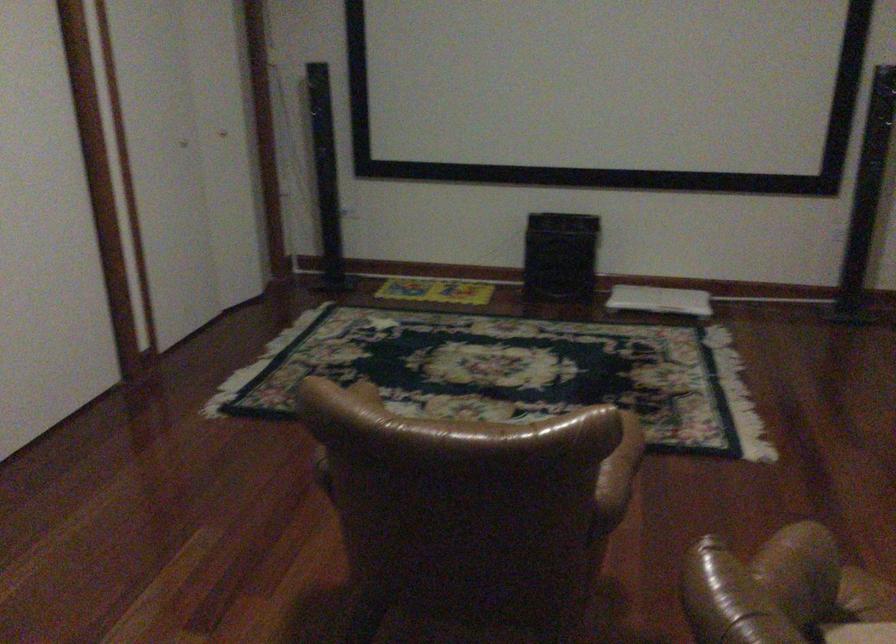
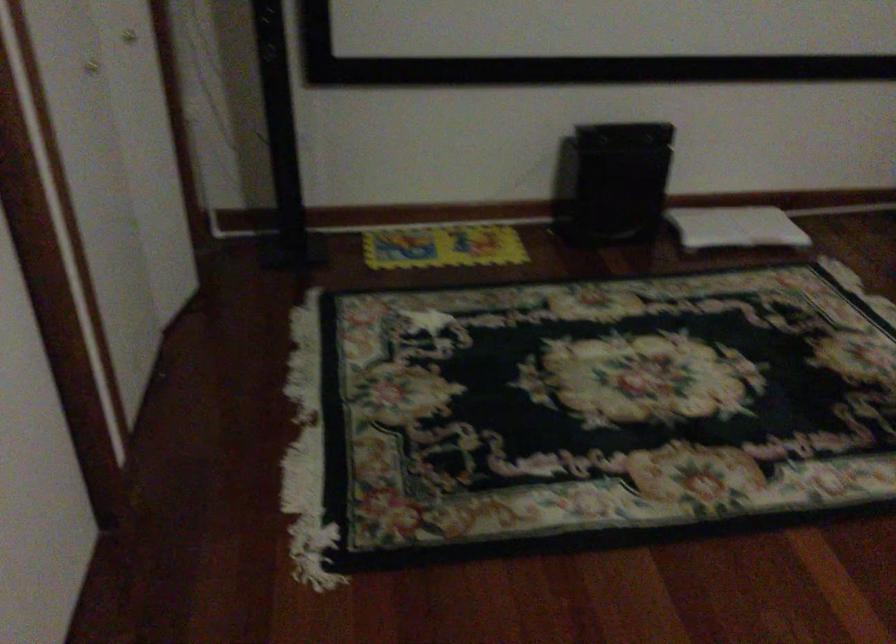
Locate, in the second image, the point that corresponds to [645,297] in the first image.

(735, 227)